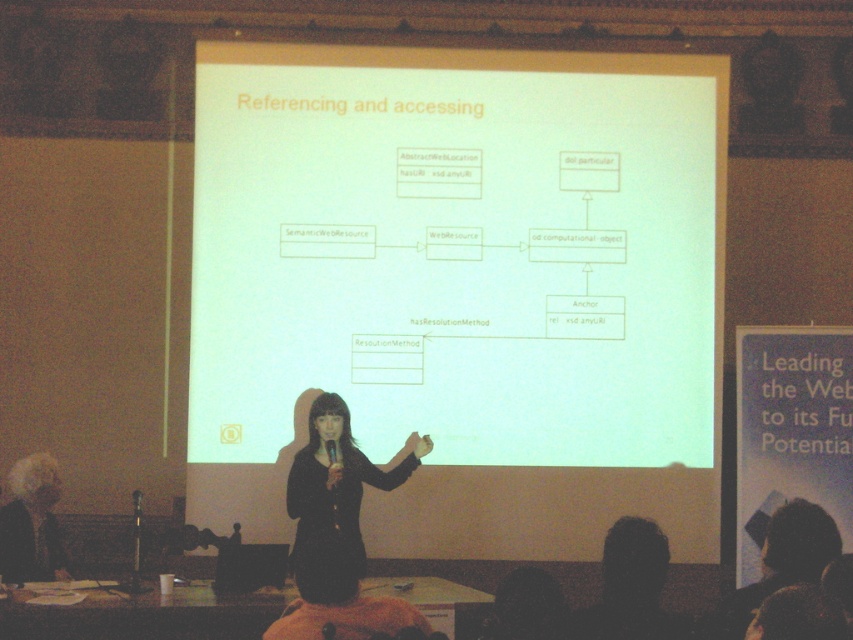
Can you confirm if white matte projector screen at center is positioned to the left of black fabric at center?

In fact, white matte projector screen at center is to the right of black fabric at center.

Measure the distance from white matte projector screen at center to black fabric at center.

white matte projector screen at center and black fabric at center are 7.36 feet apart from each other.

Between point (699, 339) and point (332, 486), which one is positioned in front?

Point (332, 486)

Identify the location of white matte projector screen at center. Image resolution: width=853 pixels, height=640 pixels. [x=456, y=252].